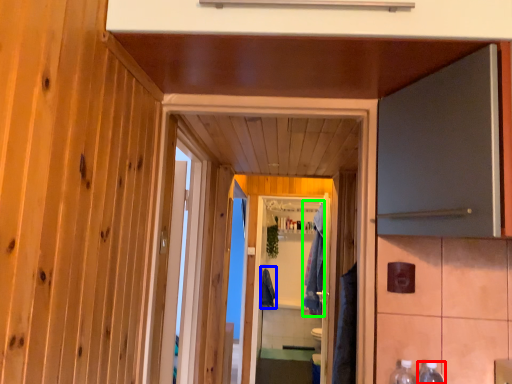
Question: Considering the real-world distances, which object is farthest from bottle (highlighted by a red box)? robe (highlighted by a blue box) or robe (highlighted by a green box)?

Choices:
 (A) robe
 (B) robe

Answer: (A)